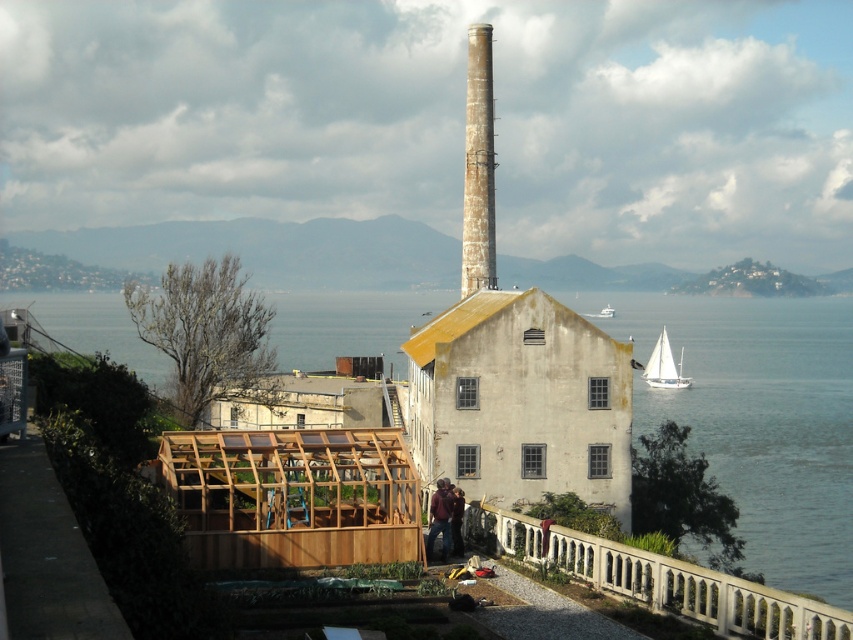
Who is higher up, transparent glass water at center or white stone railing at lower right?

transparent glass water at center

I want to click on transparent glass water at center, so click(x=762, y=420).

Between point (755, 477) and point (589, 556), which one is positioned in front?

Point (589, 556)

The image size is (853, 640). Find the location of `transparent glass water at center`. transparent glass water at center is located at coordinates (762, 420).

Who is more distant from viewer, (751,436) or (461,547)?

The point (751,436) is behind.

Locate an element on the screen. transparent glass water at center is located at coordinates (762, 420).

This screenshot has height=640, width=853. Identify the location of transparent glass water at center. (762, 420).

Can you confirm if natural wood greenhouse at lower left is positioned to the left of brown leather jacket at center?

Correct, you'll find natural wood greenhouse at lower left to the left of brown leather jacket at center.

Where is `natural wood greenhouse at lower left`? This screenshot has width=853, height=640. natural wood greenhouse at lower left is located at coordinates (292, 497).